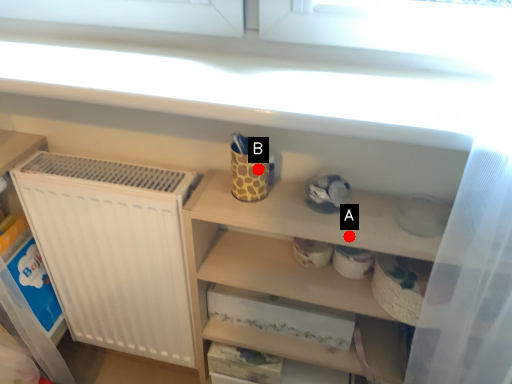
Question: Two points are circled on the image, labeled by A and B beside each circle. Which point is closer to the camera?

Choices:
 (A) A is closer
 (B) B is closer

Answer: (A)